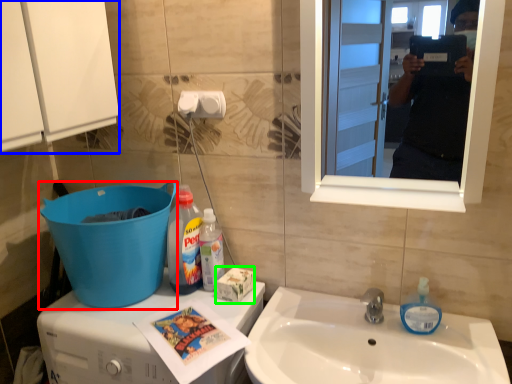
Question: Considering the real-world distances, which object is farthest from trash bin/can (highlighted by a red box)? cabinetry (highlighted by a blue box) or box (highlighted by a green box)?

Choices:
 (A) cabinetry
 (B) box

Answer: (A)